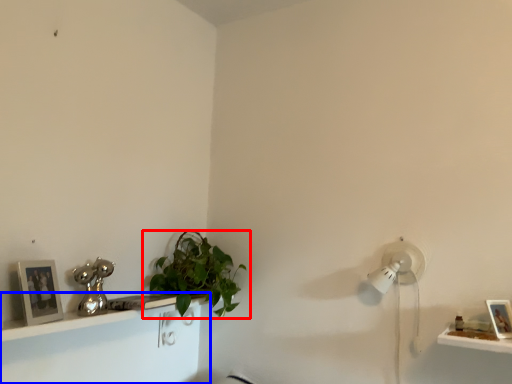
Question: Among these objects, which one is farthest to the camera, houseplant (highlighted by a red box) or shelf (highlighted by a blue box)?

Choices:
 (A) houseplant
 (B) shelf

Answer: (A)